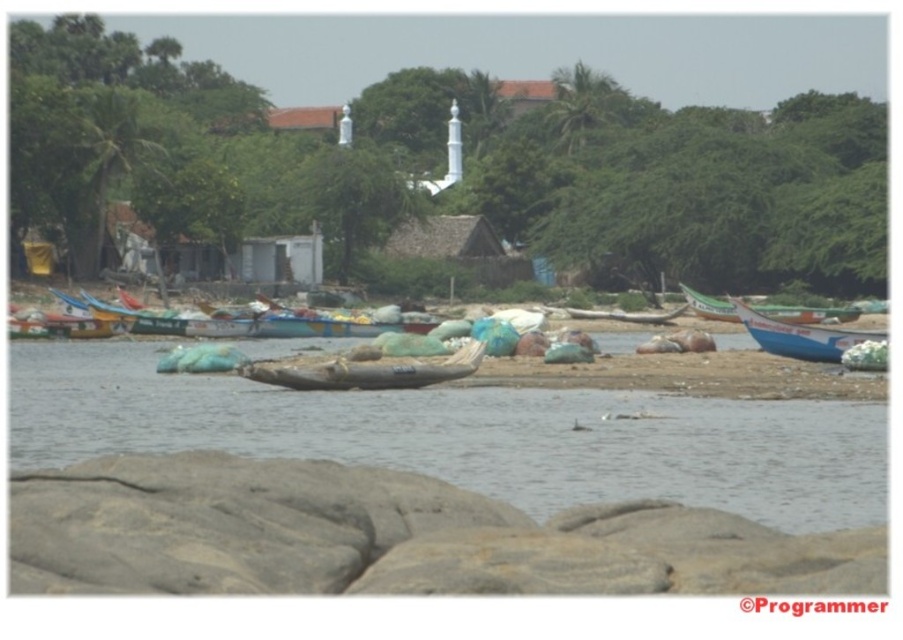
Question: Can you confirm if wooden boat at center is thinner than blue plastic boat at left?

Choices:
 (A) no
 (B) yes

Answer: (A)

Question: Is blue tarpaulin boat at center thinner than blue plastic boat at right?

Choices:
 (A) no
 (B) yes

Answer: (B)

Question: Which object appears farthest from the camera in this image?

Choices:
 (A) brown woven basket at center
 (B) wooden boat at center
 (C) blue plastic boat at right

Answer: (B)

Question: Which point is closer to the camera?

Choices:
 (A) (22, 448)
 (B) (166, 330)
 (C) (780, 316)

Answer: (A)

Question: Does blue plastic boat at right have a lesser width compared to blue plastic boat at left?

Choices:
 (A) no
 (B) yes

Answer: (A)

Question: Among these points, which one is nearest to the camera?

Choices:
 (A) (573, 449)
 (B) (880, 336)

Answer: (A)